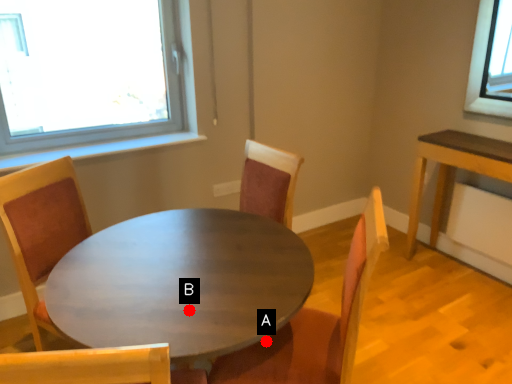
Question: Two points are circled on the image, labeled by A and B beside each circle. Which point appears closest to the camera in this image?

Choices:
 (A) A is closer
 (B) B is closer

Answer: (B)